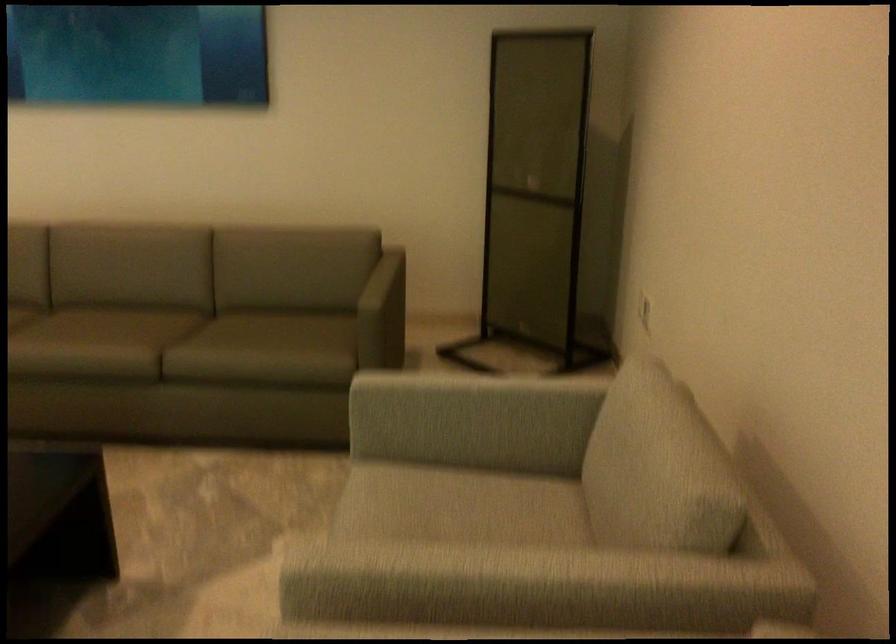
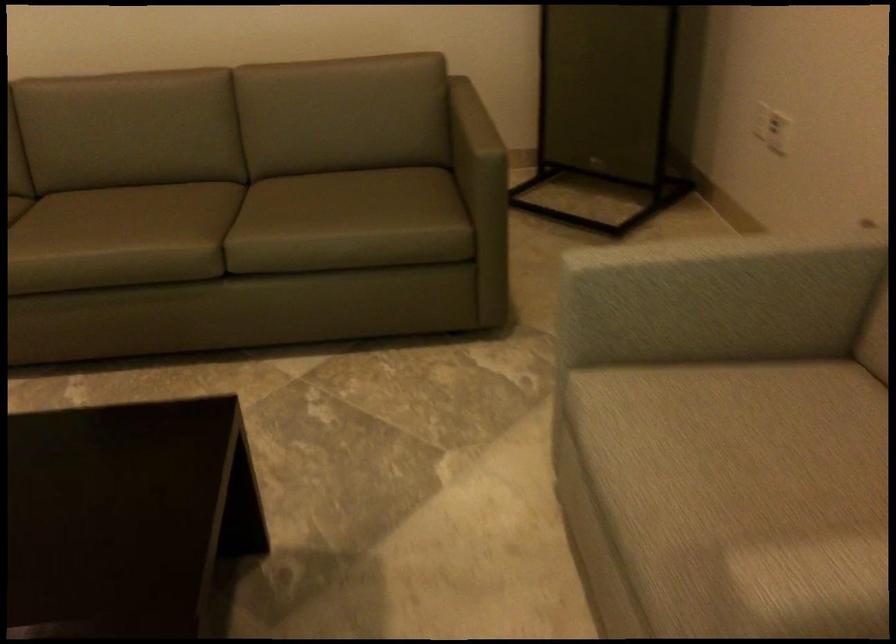
Question: The images are taken continuously from a first-person perspective. In which direction is your viewpoint rotating?

Choices:
 (A) Left
 (B) Right
 (C) Up
 (D) Down

Answer: (D)